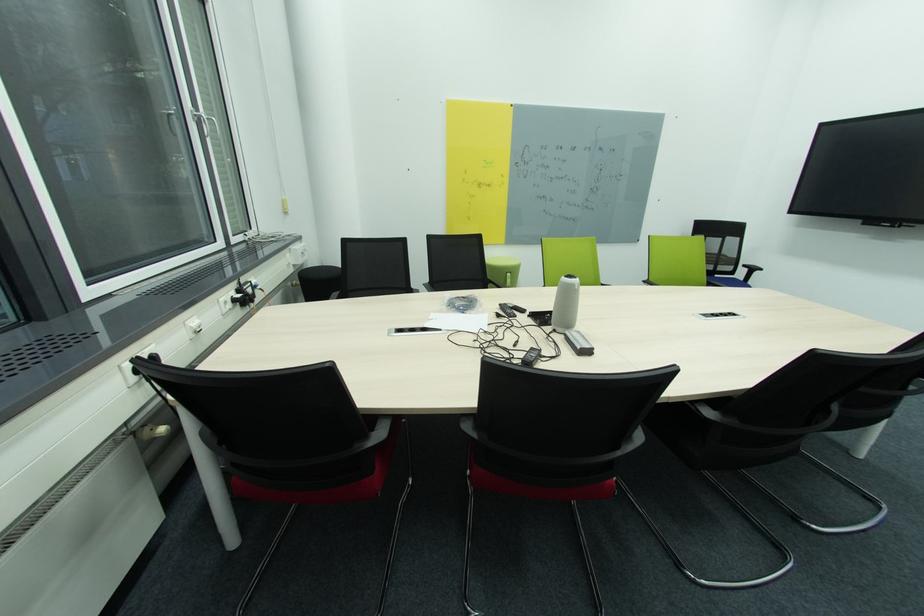
Where is `white window handle`? The width and height of the screenshot is (924, 616). white window handle is located at coordinates pos(196,115).